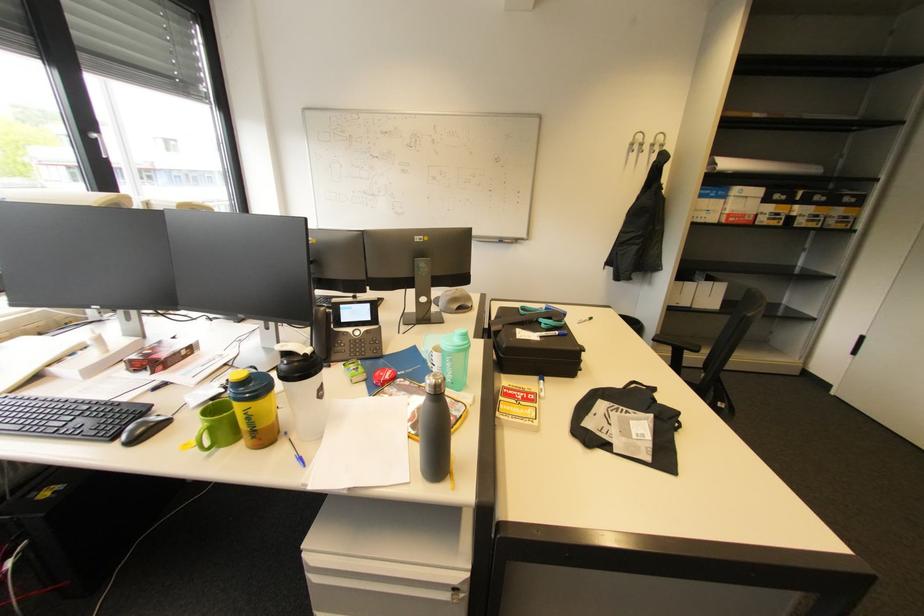
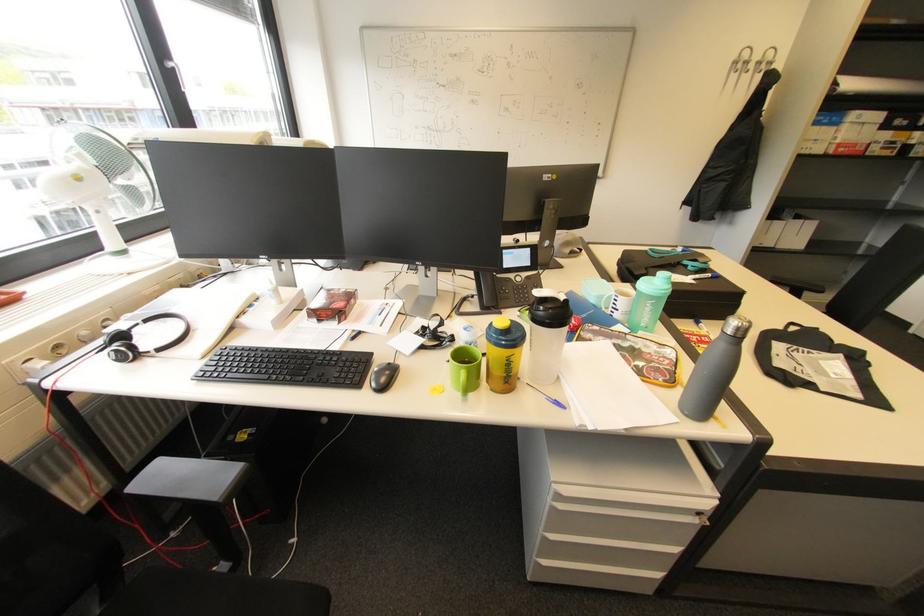
Where in the second image is the point corresponding to pixel 645 138 from the first image?

(751, 54)